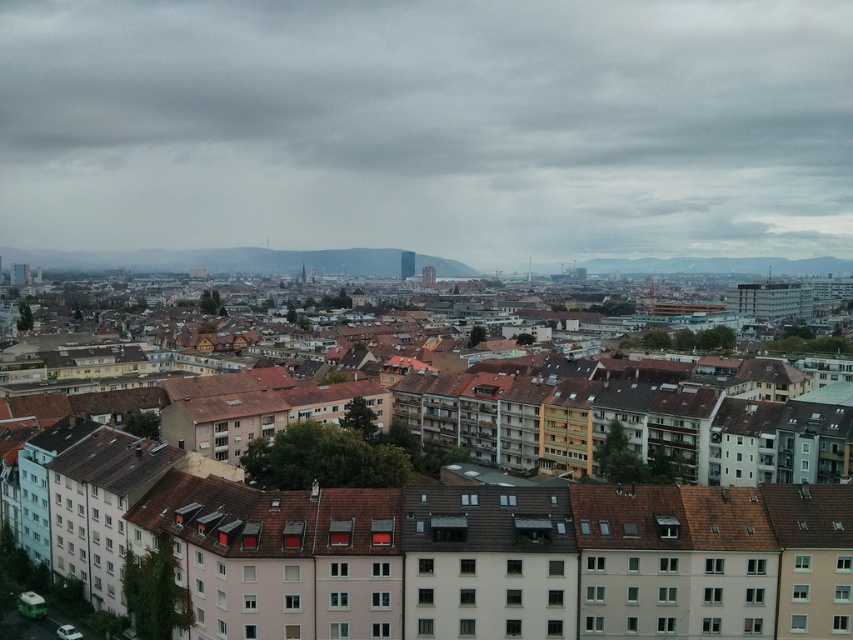
Can you confirm if cloudy sky at center is shorter than matte brown buildings at center?

No.

Who is more distant from viewer, (814, 84) or (843, 387)?

Positioned behind is point (814, 84).

Identify the location of cloudy sky at center. (428, 125).